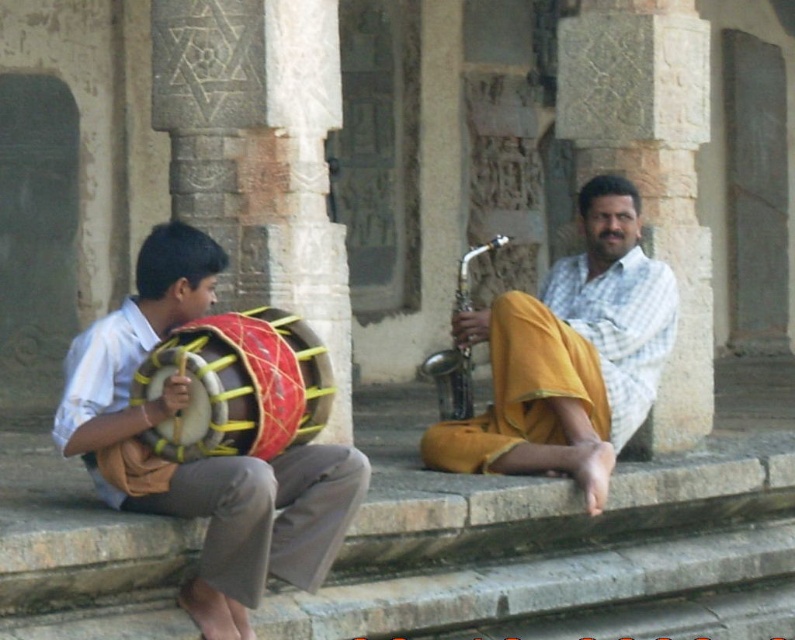
Who is positioned more to the left, yellow cotton pants at center or red leather drum at left?

red leather drum at left is more to the left.

Can you confirm if yellow cotton pants at center is bigger than red leather drum at left?

Yes, yellow cotton pants at center is bigger than red leather drum at left.

Identify the location of yellow cotton pants at center. (569, 356).

Does matte red drum at left come in front of yellow cotton pants at center?

Yes, it is in front of yellow cotton pants at center.

Who is higher up, matte red drum at left or yellow cotton pants at center?

matte red drum at left is higher up.

Identify the location of matte red drum at left. Image resolution: width=795 pixels, height=640 pixels. (204, 458).

Can you confirm if matte red drum at left is positioned to the right of red leather drum at left?

No, matte red drum at left is not to the right of red leather drum at left.

Between point (70, 419) and point (196, 432), which one is positioned behind?

Point (70, 419)

Which is in front, point (212, 580) or point (270, 412)?

Point (212, 580) is more forward.

Image resolution: width=795 pixels, height=640 pixels. I want to click on matte red drum at left, so click(204, 458).